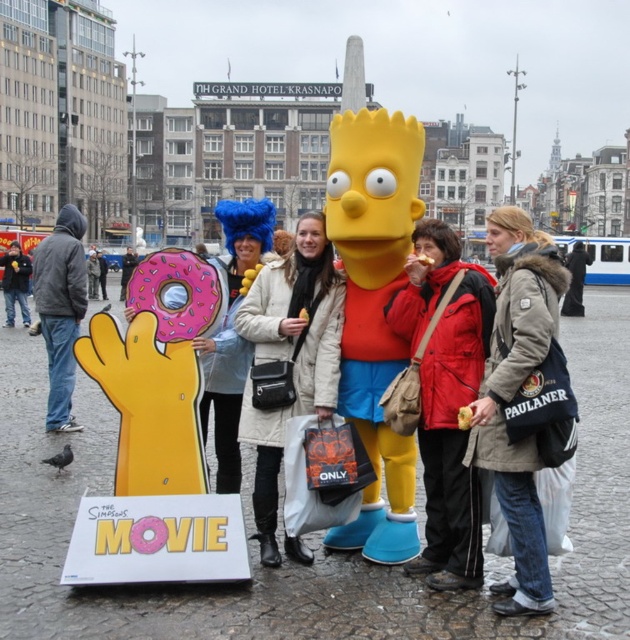
Does light brown leather jacket at center appear on the right side of red jacket at center?

Indeed, light brown leather jacket at center is positioned on the right side of red jacket at center.

Between light brown leather jacket at center and red jacket at center, which one has more height?

Standing taller between the two is light brown leather jacket at center.

Does point (551, 451) come in front of point (461, 481)?

Yes.

The height and width of the screenshot is (640, 630). In order to click on light brown leather jacket at center in this screenshot , I will do `click(522, 400)`.

Is blue fuzzy wig at center thinner than jeans at center?

In fact, blue fuzzy wig at center might be wider than jeans at center.

Can you confirm if blue fuzzy wig at center is positioned to the left of jeans at center?

In fact, blue fuzzy wig at center is to the right of jeans at center.

Who is more distant from viewer, (x=224, y=349) or (x=25, y=323)?

Result: Positioned behind is point (x=25, y=323).

Locate an element on the screen. The height and width of the screenshot is (640, 630). blue fuzzy wig at center is located at coordinates (231, 332).

Between point (214, 337) and point (47, 296), which one is positioned in front?

Positioned in front is point (214, 337).

Between blue fuzzy wig at center and dark gray hoodie at left, which one has less height?

dark gray hoodie at left

The height and width of the screenshot is (640, 630). Describe the element at coordinates (231, 332) in the screenshot. I see `blue fuzzy wig at center` at that location.

This screenshot has height=640, width=630. In order to click on blue fuzzy wig at center in this screenshot , I will do `click(231, 332)`.